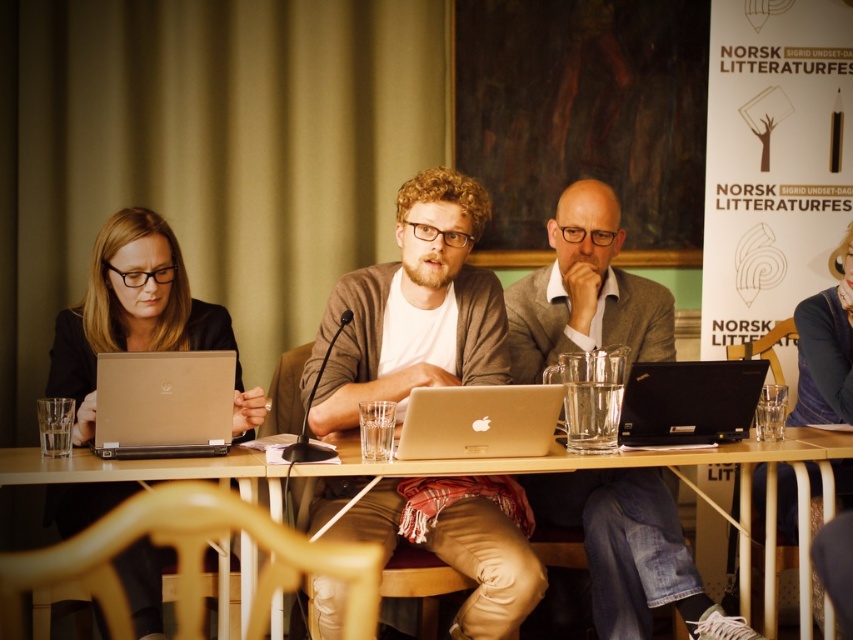
Question: Which object appears closest to the camera in this image?

Choices:
 (A) silver metallic laptop at left
 (B) matte black jacket at center
 (C) matte gray blazer at center
 (D) wooden at center

Answer: (D)

Question: Does matte black laptop at left have a greater width compared to black plastic laptop at center?

Choices:
 (A) no
 (B) yes

Answer: (B)

Question: Is the position of silver metallic laptop at left less distant than that of black plastic laptop at center?

Choices:
 (A) yes
 (B) no

Answer: (A)

Question: Which point is closer to the camera?

Choices:
 (A) (140, 561)
 (B) (413, 445)
 (C) (428, 467)
 (D) (323, 360)

Answer: (D)

Question: Estimate the real-world distances between objects in this image. Which object is farther from the matte black jacket at center?

Choices:
 (A) wooden at center
 (B) matte black laptop at left

Answer: (B)

Question: Can you confirm if silver metallic laptop at left is positioned to the left of matte black jacket at center?

Choices:
 (A) yes
 (B) no

Answer: (A)